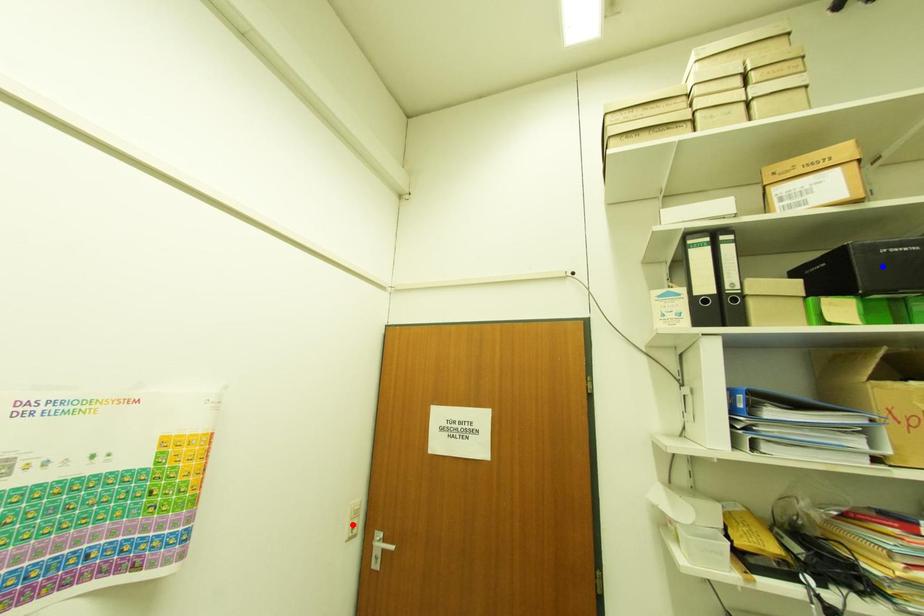
Question: Two points are marked on the image. Which point is closer to the camera?

Choices:
 (A) Blue point is closer.
 (B) Red point is closer.

Answer: (A)